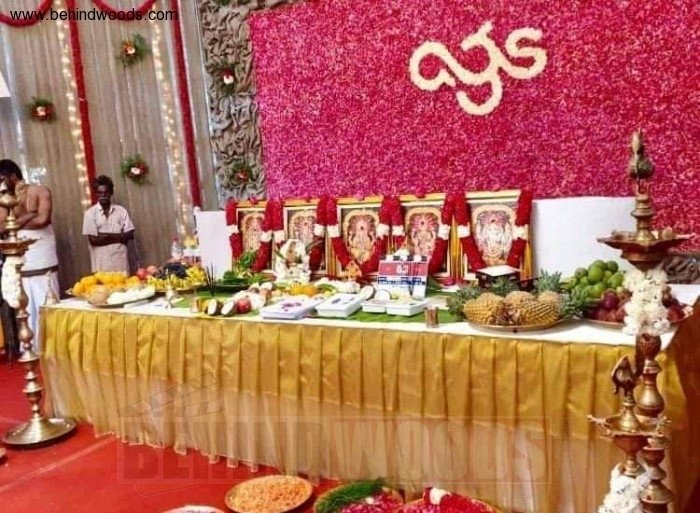
Identify the location of floral wall. (309, 100).